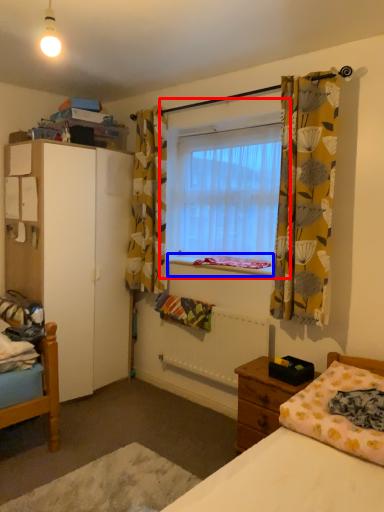
Question: Which object appears closest to the camera in this image, window (highlighted by a red box) or window sill (highlighted by a blue box)?

Choices:
 (A) window
 (B) window sill

Answer: (A)